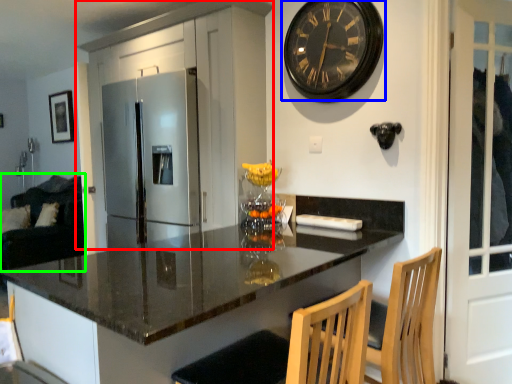
Question: Estimate the real-world distances between objects in this image. Which object is farther from cabinetry (highlighted by a red box), wall clock (highlighted by a blue box) or couch (highlighted by a green box)?

Choices:
 (A) wall clock
 (B) couch

Answer: (B)